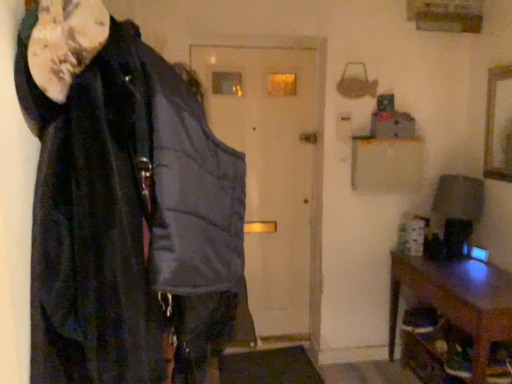
Question: From a real-world perspective, relative to velvet black cloak at left, is matte gray vest at center vertically above or below?

Choices:
 (A) above
 (B) below

Answer: (B)

Question: Is matte gray vest at center taller or shorter than velvet black cloak at left?

Choices:
 (A) tall
 (B) short

Answer: (A)

Question: Which is nearer to the matte gray vest at center?

Choices:
 (A) brown wooden table at lower right
 (B) wooden picture frame at upper right
 (C) velvet black cloak at left

Answer: (A)

Question: Which is nearer to the matte gray vest at center?

Choices:
 (A) wooden picture frame at upper right
 (B) velvet black cloak at left
 (C) brown wooden table at lower right

Answer: (C)